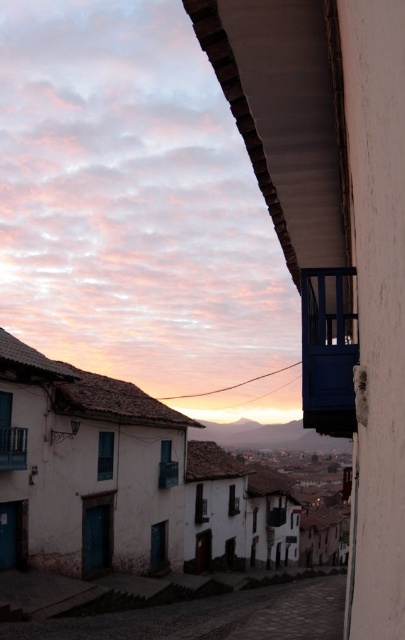
Question: Is white stucco buildings at center smaller than smooth wooden balcony at lower left?

Choices:
 (A) no
 (B) yes

Answer: (A)

Question: Is white stucco buildings at center smaller than matte blue balcony at center?

Choices:
 (A) yes
 (B) no

Answer: (B)

Question: Can you confirm if white stucco buildings at center is thinner than matte blue balcony at center?

Choices:
 (A) no
 (B) yes

Answer: (A)

Question: Which is farther from the smooth wooden balcony at lower left?

Choices:
 (A) cobblestone stairs at lower center
 (B) matte blue balcony at center
 (C) white stucco buildings at center

Answer: (B)

Question: Which point appears closest to the camera in this image?

Choices:
 (A) (14, 362)
 (B) (302, 339)
 (C) (0, 449)
 (D) (215, 634)

Answer: (B)

Question: Considering the real-world distances, which object is farthest from the matte blue balcony at center?

Choices:
 (A) smooth wooden balcony at lower left
 (B) white stucco buildings at center
 (C) cobblestone stairs at lower center

Answer: (B)